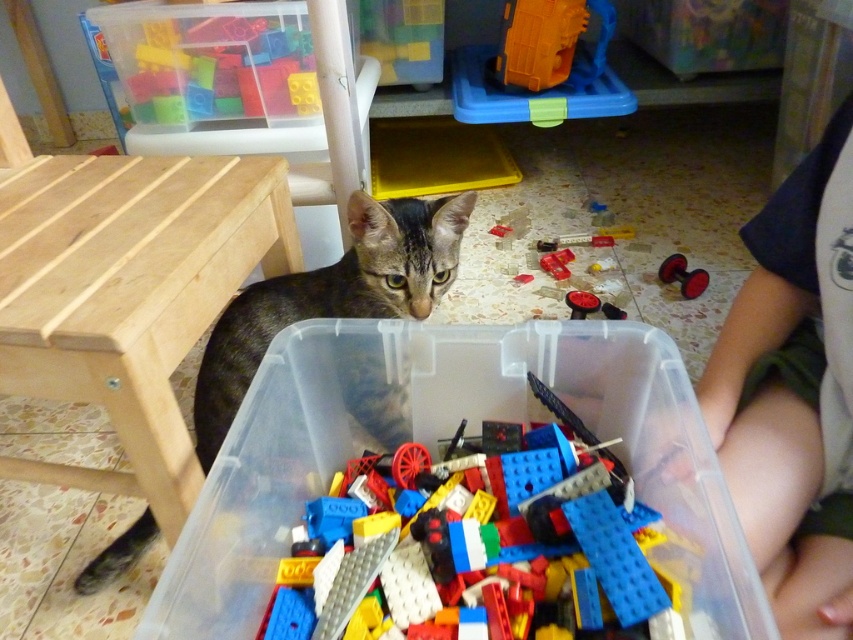
Question: Which point is farther to the camera?

Choices:
 (A) (554, 4)
 (B) (374, 292)
 (C) (570, 257)
 (D) (248, 577)

Answer: (A)

Question: Does translucent plastic container at lower center appear on the left side of bare wood stool at left?

Choices:
 (A) yes
 (B) no

Answer: (B)

Question: Which point is farther from the camera taking this photo?

Choices:
 (A) (280, 196)
 (B) (570, 51)
 (C) (560, 275)
 (D) (250, 508)

Answer: (B)

Question: Is orange plastic toy at upper center bigger than rubberized red bricks at center?

Choices:
 (A) yes
 (B) no

Answer: (A)

Question: Does tabby fur cat at under table have a greater width compared to rubberized red bricks at center?

Choices:
 (A) no
 (B) yes

Answer: (B)

Question: Which of these objects is positioned farthest from the translucent plastic container at lower center?

Choices:
 (A) rubberized red wheels at lower center
 (B) orange plastic toy at upper center

Answer: (B)